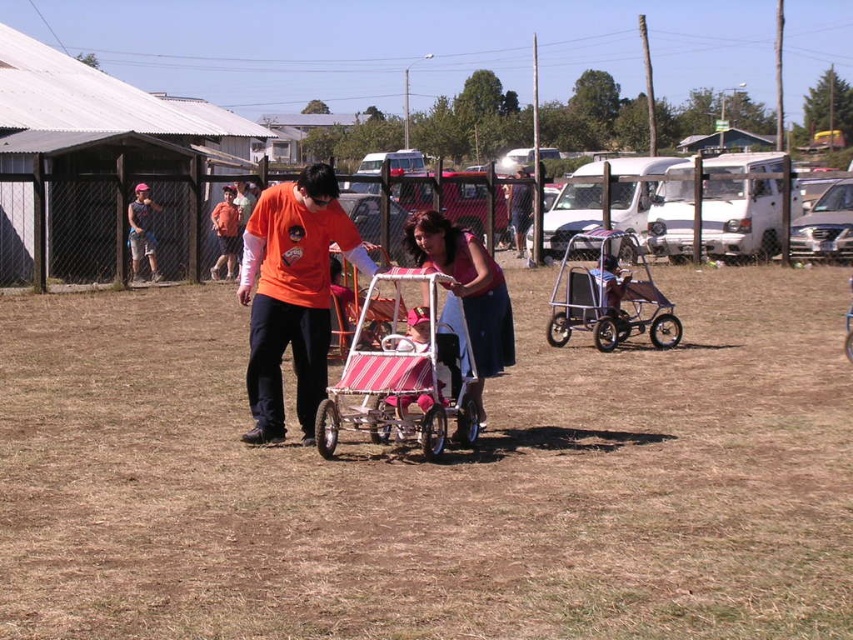
Question: Considering the relative positions of orange matte shirt at center and pink fabric stroller at center in the image provided, where is orange matte shirt at center located with respect to pink fabric stroller at center?

Choices:
 (A) left
 (B) right

Answer: (A)

Question: Which is nearer to the orange matte shirt at center?

Choices:
 (A) matte orange shirt at center
 (B) metallic silver baby carriage at center

Answer: (B)

Question: Which point is closer to the camera taking this photo?

Choices:
 (A) (573, 241)
 (B) (416, 275)

Answer: (B)

Question: Can you confirm if striped fabric stroller at center is thinner than metallic silver baby carriage at center?

Choices:
 (A) yes
 (B) no

Answer: (B)

Question: Which object appears farthest from the camera in this image?

Choices:
 (A) pink fabric stroller at center
 (B) metallic silver baby carriage at center
 (C) matte orange shirt at center

Answer: (C)

Question: Where is striped fabric stroller at center located in relation to metallic silver baby carriage at center in the image?

Choices:
 (A) left
 (B) right

Answer: (A)